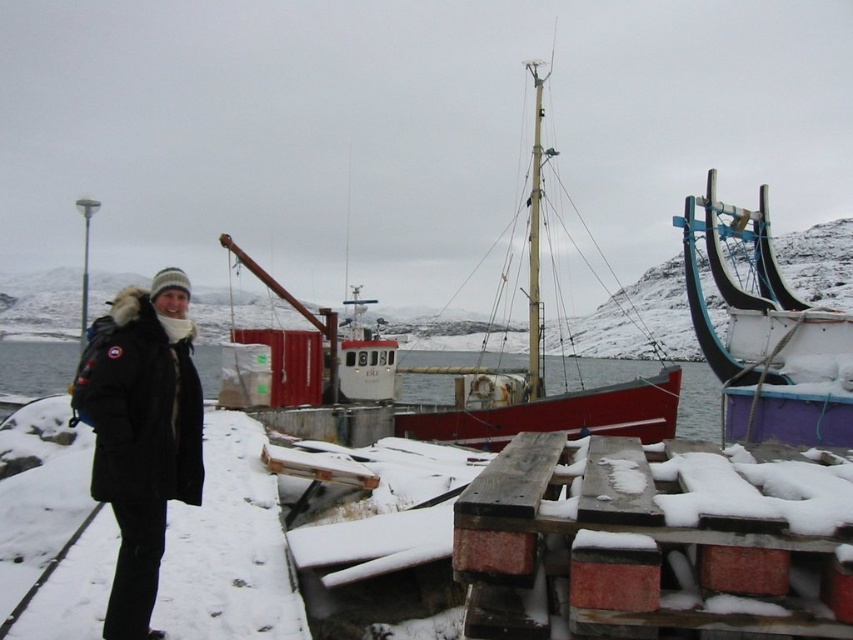
Who is shorter, snow-covered wooden pallets at lower center or red wooden sailboat at center?

With less height is snow-covered wooden pallets at lower center.

What do you see at coordinates (654, 540) in the screenshot?
I see `snow-covered wooden pallets at lower center` at bounding box center [654, 540].

Locate an element on the screen. snow-covered wooden pallets at lower center is located at coordinates (654, 540).

Who is shorter, black fuzzy coat at left or red wooden sailboat at center?

black fuzzy coat at left

Is black fuzzy coat at left positioned before red wooden sailboat at center?

Yes, it is.

Locate an element on the screen. Image resolution: width=853 pixels, height=640 pixels. black fuzzy coat at left is located at coordinates (141, 433).

The width and height of the screenshot is (853, 640). I want to click on black fuzzy coat at left, so click(141, 433).

Does white painted wood boat at right have a lesser width compared to clear water at center?

Yes, white painted wood boat at right is thinner than clear water at center.

Which is below, white painted wood boat at right or clear water at center?

clear water at center

This screenshot has width=853, height=640. I want to click on white painted wood boat at right, so click(767, 337).

The height and width of the screenshot is (640, 853). I want to click on white painted wood boat at right, so click(x=767, y=337).